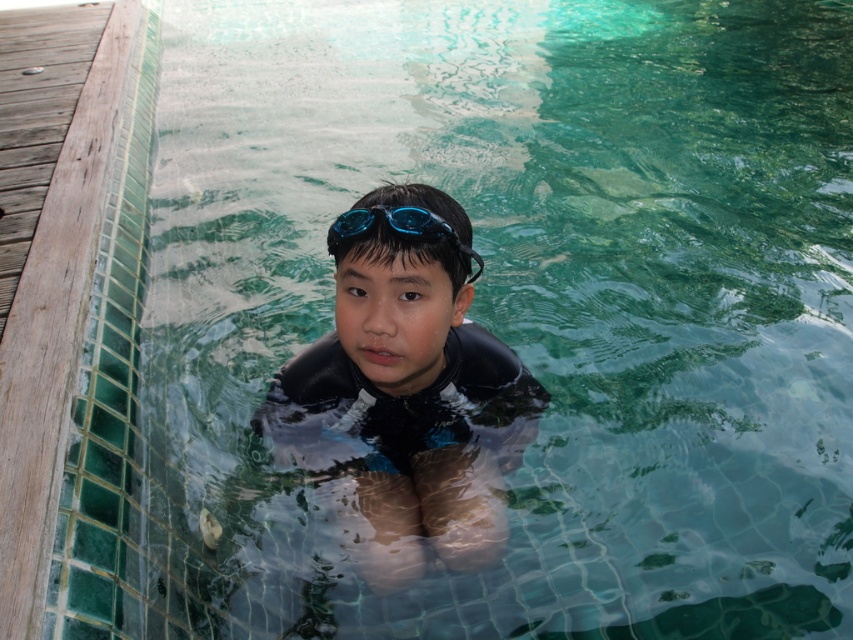
Can you confirm if black matte wetsuit at center is bigger than blue matte swimming goggles at center?

Yes, black matte wetsuit at center is bigger than blue matte swimming goggles at center.

The image size is (853, 640). Identify the location of black matte wetsuit at center. (401, 406).

Which is behind, point (469, 436) or point (434, 225)?

The point (469, 436) is behind.

Where is `black matte wetsuit at center`? The height and width of the screenshot is (640, 853). black matte wetsuit at center is located at coordinates (401, 406).

Which is behind, point (370, 250) or point (376, 396)?

Positioned behind is point (376, 396).

Measure the distance between point (434, 420) and camera.

Point (434, 420) and camera are 2.15 meters apart from each other.

I want to click on matte black swim vest at center, so click(x=410, y=385).

Is point (393, 483) more distant than point (392, 227)?

Yes.

Which is behind, point (381, 582) or point (405, 218)?

Point (381, 582)

Locate an element on the screen. Image resolution: width=853 pixels, height=640 pixels. matte black swim vest at center is located at coordinates (410, 385).